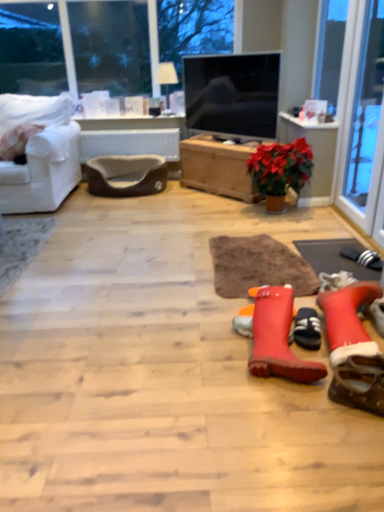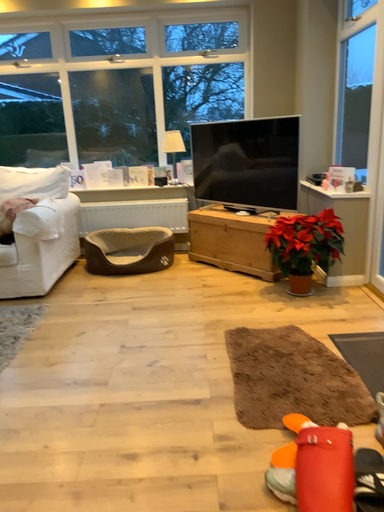
Question: How did the camera likely rotate when shooting the video?

Choices:
 (A) rotated upward
 (B) rotated downward

Answer: (A)